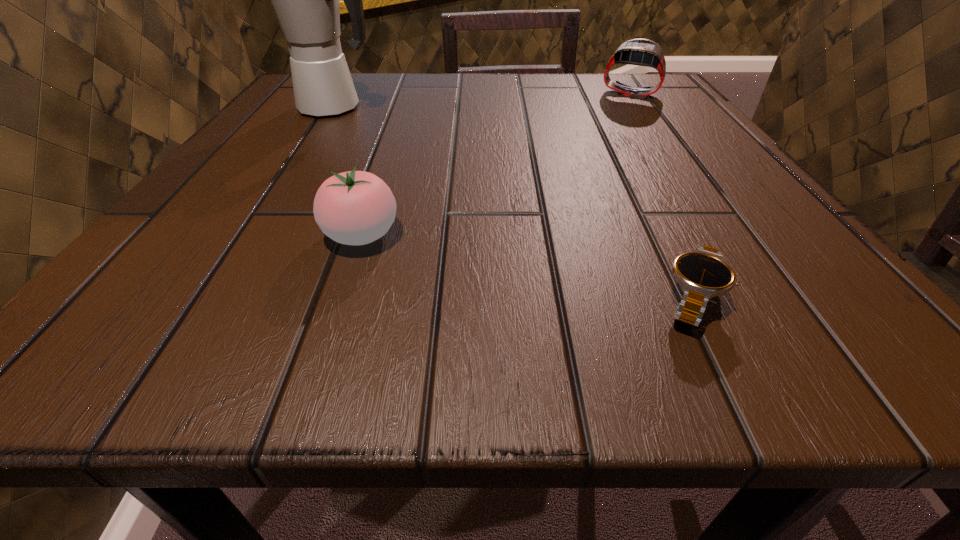
The width and height of the screenshot is (960, 540). Find the location of `watch located at the far edge`. watch located at the far edge is located at coordinates (642, 52).

What are the coordinates of `object at the near edge` in the screenshot? It's located at point(703,273).

Image resolution: width=960 pixels, height=540 pixels. Find the location of `object positioned at the left edge`. object positioned at the left edge is located at coordinates (305, 0).

You are a GUI agent. You are given a task and a screenshot of the screen. Output one action in this format:
    pyautogui.click(x=<x>, y=<y>)
    Task: Click on the object located at the far left corner
    This screenshot has width=960, height=540.
    Given the screenshot: What is the action you would take?
    point(305,0)

The height and width of the screenshot is (540, 960). In order to click on object located in the far right corner section of the desktop in this screenshot , I will do [642, 52].

Identify the location of object that is at the near right corner. pos(703,273).

This screenshot has width=960, height=540. Identify the location of vacant space at the far edge. (387, 111).

Image resolution: width=960 pixels, height=540 pixels. What are the coordinates of `vacant area at the near edge of the desktop` in the screenshot? It's located at (669, 350).

Locate an element on the screen. Image resolution: width=960 pixels, height=540 pixels. vacant space at the right edge of the desktop is located at coordinates (735, 261).

You are a GUI agent. You are given a task and a screenshot of the screen. Output one action in this format:
    pyautogui.click(x=<x>, y=<y>)
    Task: Click on the vacant space at the near left corner of the desktop
    
    Given the screenshot: What is the action you would take?
    [121, 296]